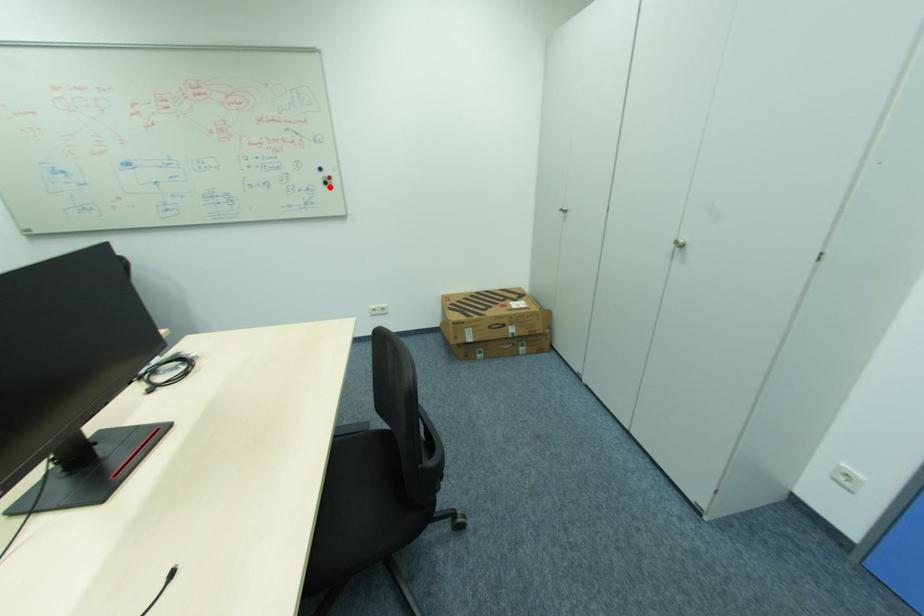
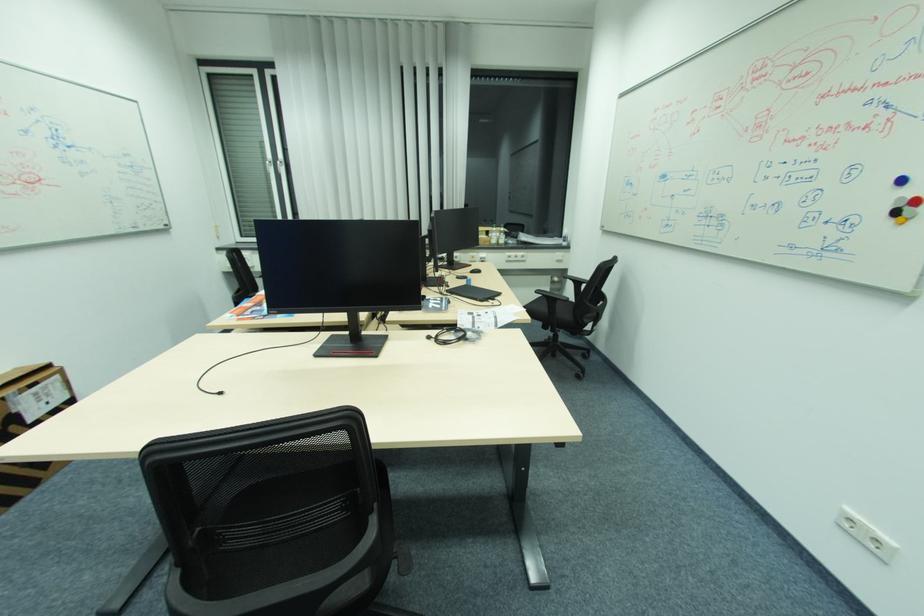
Find the pixel in the second image that matches the highlighted location in the first image.

(896, 221)